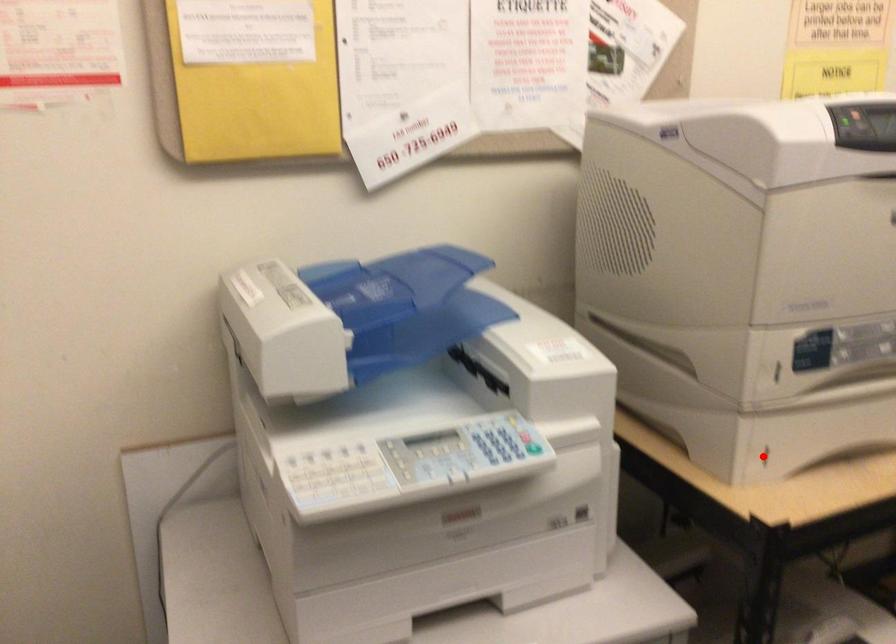
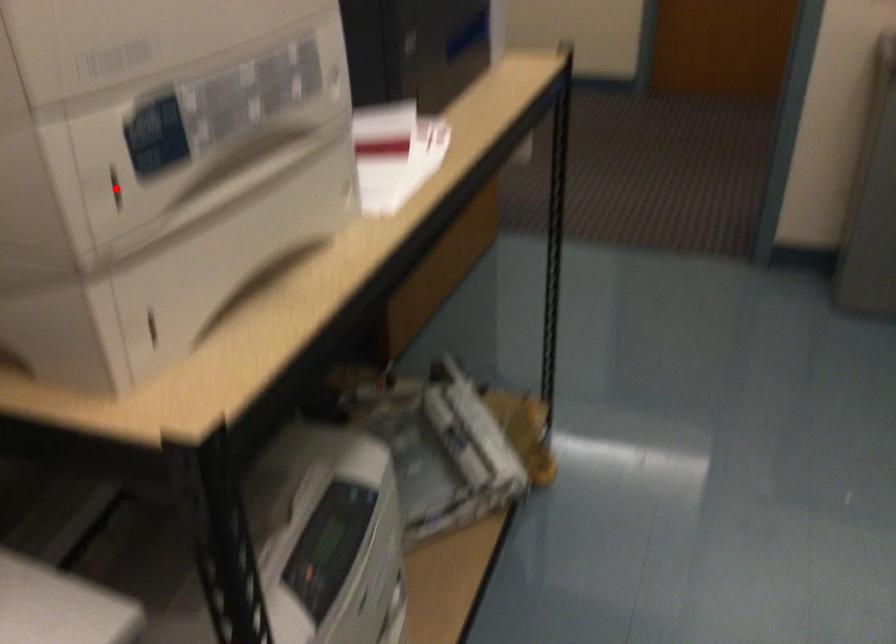
I am providing you with two images of the same scene from different viewpoints. A red point is marked on the first image and another point is marked on the second image. Is the red point in image1 aligned with the point shown in image2?

No